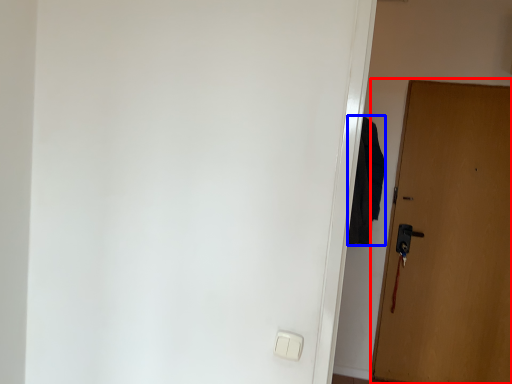
Question: Among these objects, which one is nearest to the camera, door (highlighted by a red box) or robe (highlighted by a blue box)?

Choices:
 (A) door
 (B) robe

Answer: (B)